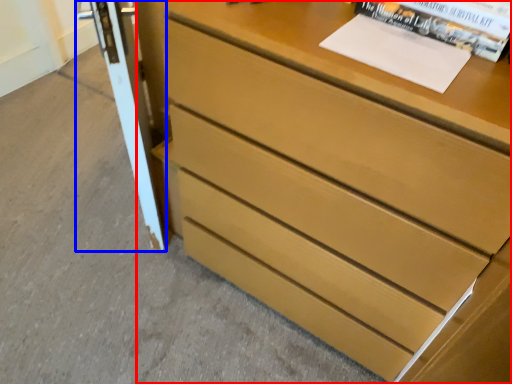
Question: Which point is closer to the camera, chest of drawers (highlighted by a red box) or screen door (highlighted by a blue box)?

Choices:
 (A) chest of drawers
 (B) screen door

Answer: (A)